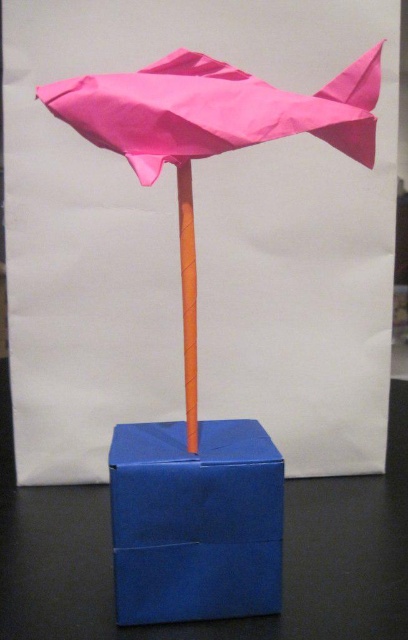
Can you confirm if pink paper umbrella at center is bigger than pink paper fish at upper center?

Yes, pink paper umbrella at center is bigger than pink paper fish at upper center.

Is pink paper umbrella at center to the right of pink paper fish at upper center from the viewer's perspective?

Yes, pink paper umbrella at center is to the right of pink paper fish at upper center.

Image resolution: width=408 pixels, height=640 pixels. I want to click on pink paper umbrella at center, so click(x=212, y=109).

Consider the image. Is pink paper umbrella at center behind orange matte stick at center?

That is False.

Is pink paper umbrella at center above orange matte stick at center?

Indeed, pink paper umbrella at center is positioned over orange matte stick at center.

What are the coordinates of `pink paper umbrella at center` in the screenshot? It's located at (212, 109).

Is blue cardboard box at center above pink paper fish at upper center?

No.

Does point (150, 598) lie behind point (204, 108)?

That is True.

Between point (166, 596) and point (223, 113), which one is positioned behind?

The point (166, 596) is behind.

The image size is (408, 640). In order to click on blue cardboard box at center in this screenshot , I will do `click(195, 522)`.